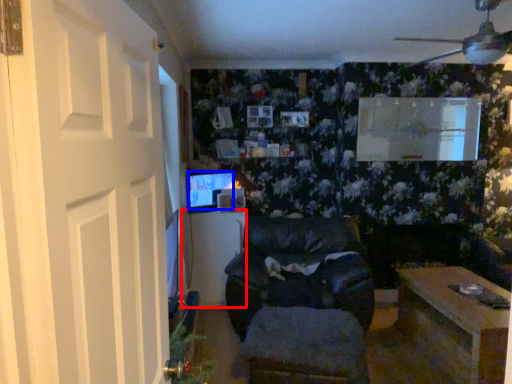
Question: Which object appears farthest to the camera in this image, table (highlighted by a red box) or computer monitor (highlighted by a blue box)?

Choices:
 (A) table
 (B) computer monitor

Answer: (A)